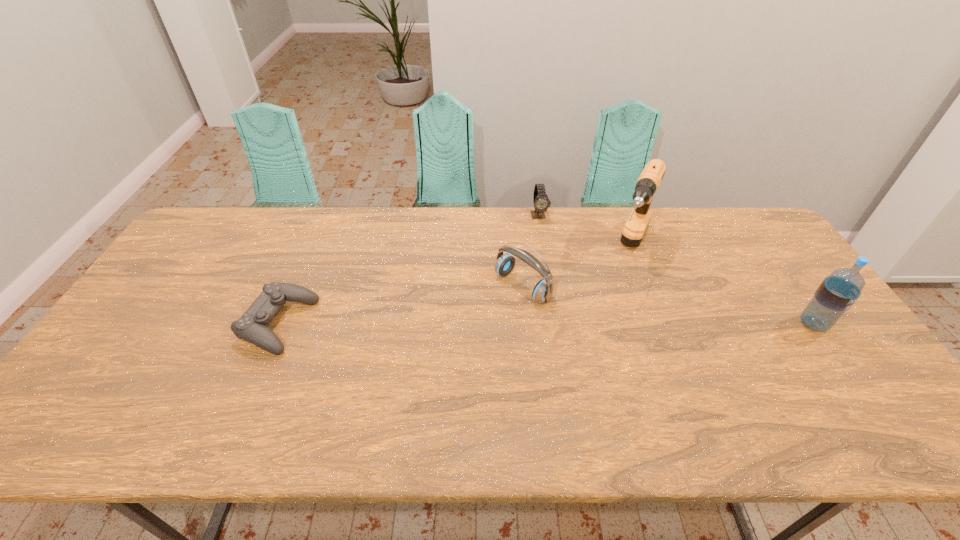
The image size is (960, 540). I want to click on blank region between the rightmost object and the watch, so click(x=676, y=269).

At what (x,y) coordinates should I click in order to perform the action: click on empty space between the water bottle and the leftmost object. Please return your answer as a coordinate pair (x, y). Looking at the image, I should click on (546, 325).

I want to click on vacant space that is in between the water bottle and the shortest object, so click(x=546, y=325).

Locate which object ranks second in proximity to the water bottle. Please provide its 2D coordinates. Your answer should be formatted as a tuple, i.e. [(x, y)], where the tuple contains the x and y coordinates of a point satisfying the conditions above.

[(543, 290)]

This screenshot has width=960, height=540. I want to click on the third closest object to the watch, so click(253, 325).